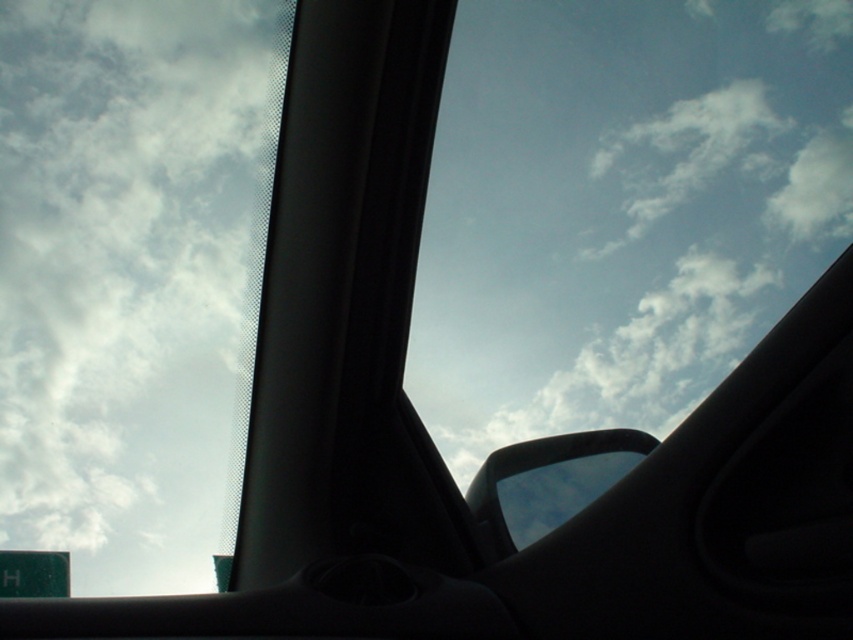
Question: Is white fluffy cloud at upper left above green matte street sign at lower left?

Choices:
 (A) no
 (B) yes

Answer: (B)

Question: Is transparent glass car window at upper center closer to camera compared to white fluffy cloud at upper left?

Choices:
 (A) no
 (B) yes

Answer: (A)

Question: Which point is closer to the camera?

Choices:
 (A) transparent glass car window at upper center
 (B) green matte street sign at lower left
 (C) white fluffy cloud at upper left
 (D) black glossy side mirror at center

Answer: (C)

Question: Which point is farther to the camera?

Choices:
 (A) (467, 292)
 (B) (598, 480)

Answer: (A)

Question: Which object is farther from the camera taking this photo?

Choices:
 (A) green matte street sign at lower left
 (B) transparent glass car window at upper center

Answer: (A)

Question: Does transparent glass car window at upper center come in front of green matte street sign at lower left?

Choices:
 (A) no
 (B) yes

Answer: (B)